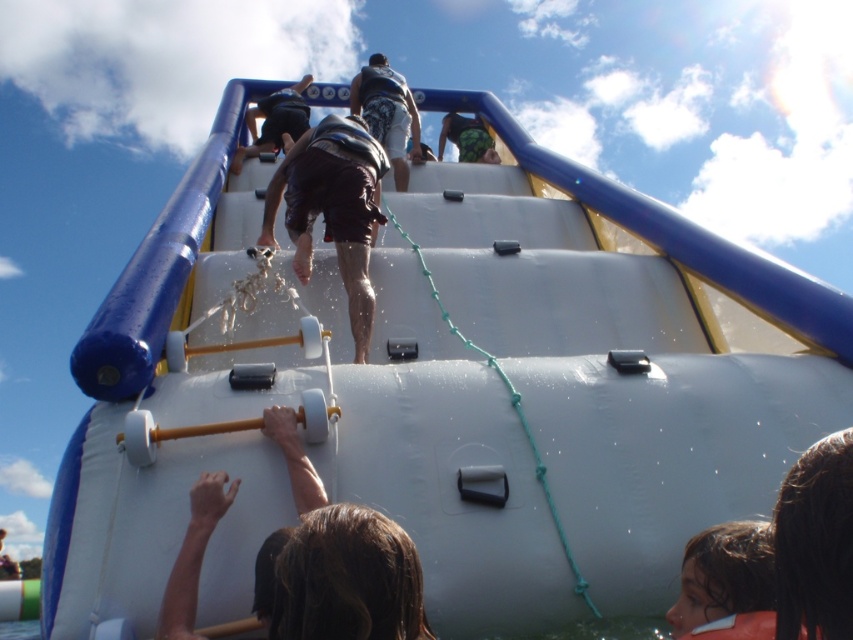
Which is more to the left, brown matte bar at center or brown textured shorts at center?

Positioned to the left is brown textured shorts at center.

Which is behind, point (221, 500) or point (10, 564)?

The point (10, 564) is behind.

Image resolution: width=853 pixels, height=640 pixels. What do you see at coordinates (193, 556) in the screenshot?
I see `brown matte bar at center` at bounding box center [193, 556].

Where is `brown matte bar at center`? Image resolution: width=853 pixels, height=640 pixels. brown matte bar at center is located at coordinates point(193,556).

The width and height of the screenshot is (853, 640). Describe the element at coordinates (723, 576) in the screenshot. I see `brown hair at lower right` at that location.

Is point (683, 620) positioned before point (444, 124)?

Yes.

What are the coordinates of `brown hair at lower right` in the screenshot? It's located at (723, 576).

Is point (422, 620) positioned behind point (305, 83)?

No.

Does point (347, 508) come closer to viewer compared to point (276, 102)?

Yes, point (347, 508) is closer to viewer.

Locate an element on the screen. The width and height of the screenshot is (853, 640). brown matte bar at center is located at coordinates (193, 556).